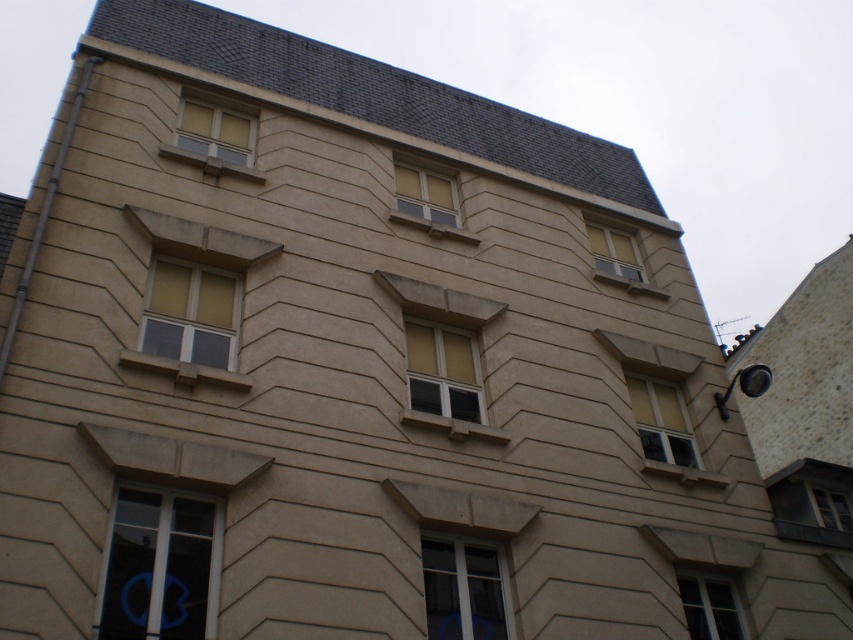
Which of these two, transparent glass window at lower left or yellow matte window at center, stands shorter?

transparent glass window at lower left

Which is behind, point (158, 579) or point (457, 337)?

The point (457, 337) is more distant.

Is point (111, 593) farther from viewer compared to point (438, 371)?

No, it is in front of (438, 371).

Locate an element on the screen. The height and width of the screenshot is (640, 853). transparent glass window at lower left is located at coordinates (161, 566).

Is matte glass window at center-right thinner than matte glass window at upper center?

Yes.

Which is in front, point (659, 417) or point (606, 240)?

Positioned in front is point (659, 417).

Where is `matte glass window at center-right`? The height and width of the screenshot is (640, 853). matte glass window at center-right is located at coordinates (660, 420).

Measure the distance between point (x=817, y=522) and camera.

They are 74.22 feet apart.

Which is more to the right, matte gray window at lower right or matte glass window at upper center?

Positioned to the right is matte gray window at lower right.

Between point (798, 480) and point (616, 268), which one is positioned behind?

The point (616, 268) is more distant.

I want to click on matte gray window at lower right, so click(811, 502).